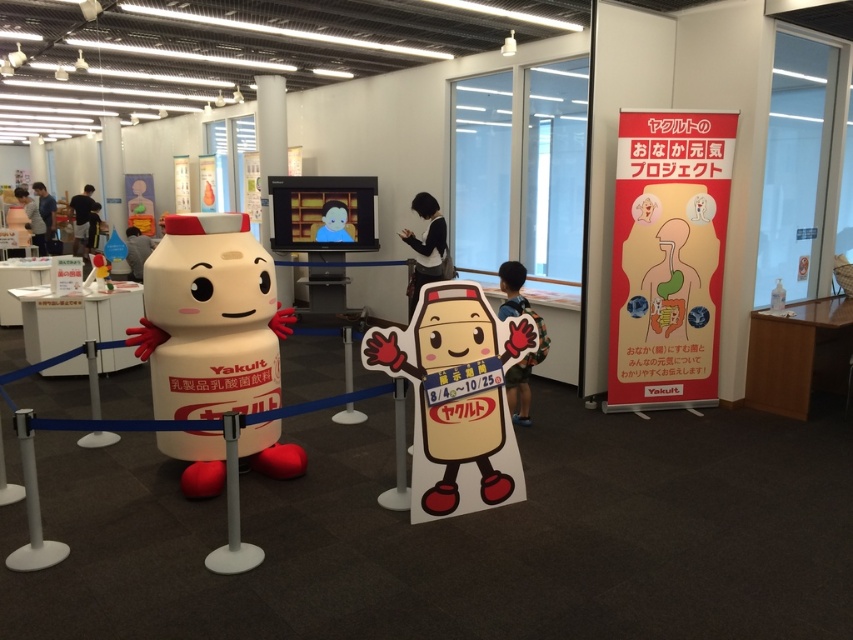
Consider the image. Between red paper banner at right and white cardboard mascot at center, which one has less height?

With less height is white cardboard mascot at center.

From the picture: Can you confirm if red paper banner at right is positioned to the right of white cardboard mascot at center?

Yes, red paper banner at right is to the right of white cardboard mascot at center.

Between point (701, 136) and point (418, 516), which one is positioned in front?

Point (418, 516)

Locate an element on the screen. The height and width of the screenshot is (640, 853). red paper banner at right is located at coordinates (668, 257).

Who is positioned more to the left, white matte plastic toy at center or white cardboard mascot at center?

white matte plastic toy at center is more to the left.

Which is behind, point (167, 372) or point (473, 320)?

The point (167, 372) is behind.

Which is in front, point (248, 275) or point (508, 356)?

Point (508, 356) is more forward.

Image resolution: width=853 pixels, height=640 pixels. Find the location of `white matte plastic toy at center`. white matte plastic toy at center is located at coordinates (210, 320).

Consider the image. Is red paper banner at right to the left of white matte plastic toy at center from the viewer's perspective?

No, red paper banner at right is not to the left of white matte plastic toy at center.

Who is positioned more to the right, red paper banner at right or white matte plastic toy at center?

red paper banner at right

At what (x,y) coordinates should I click in order to perform the action: click on red paper banner at right. Please return your answer as a coordinate pair (x, y). This screenshot has width=853, height=640. Looking at the image, I should click on (668, 257).